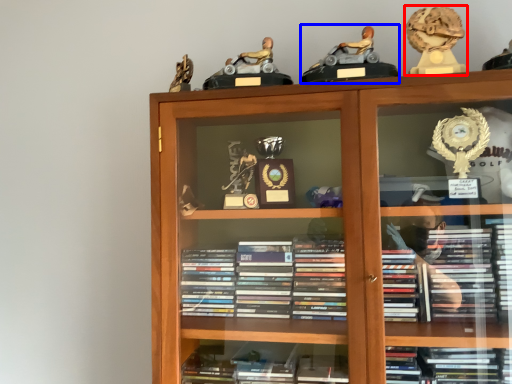
Question: Which of the following is the closest to the observer, toy (highlighted by a red box) or toy (highlighted by a blue box)?

Choices:
 (A) toy
 (B) toy

Answer: (B)